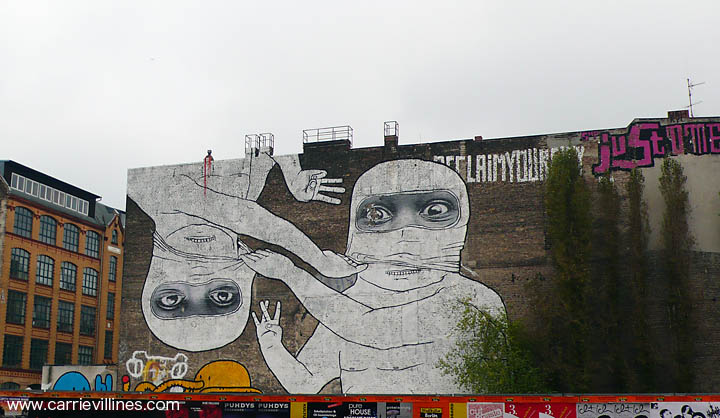
I want to click on window, so click(88, 248).